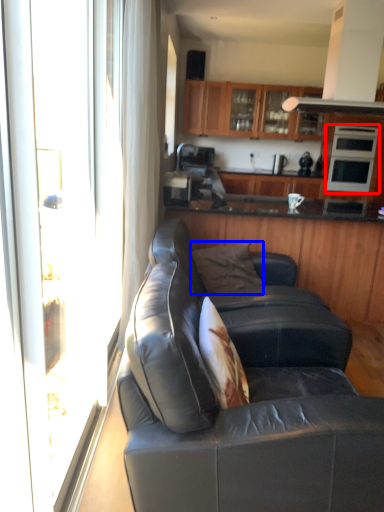
Question: Which object appears farthest to the camera in this image, appliance (highlighted by a red box) or pillow (highlighted by a blue box)?

Choices:
 (A) appliance
 (B) pillow

Answer: (A)